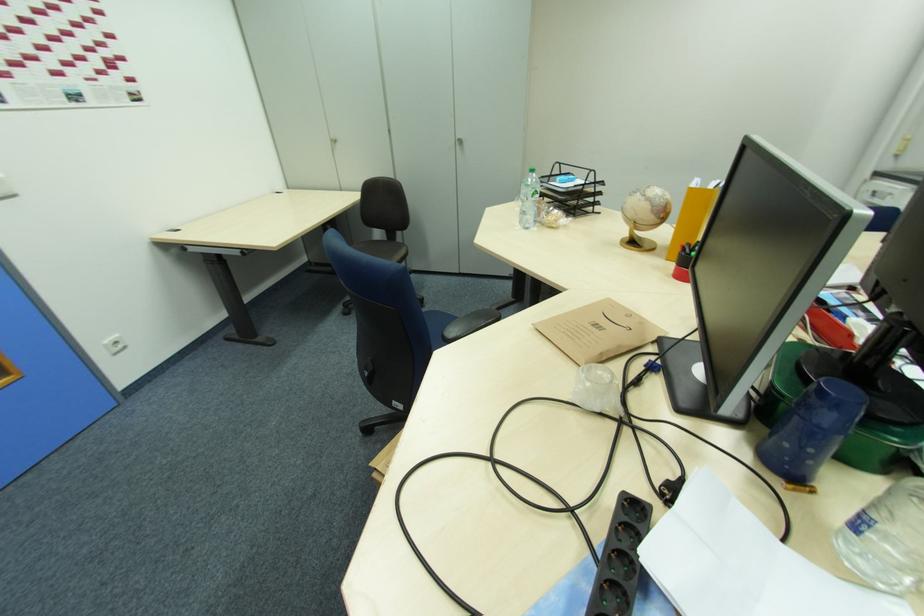
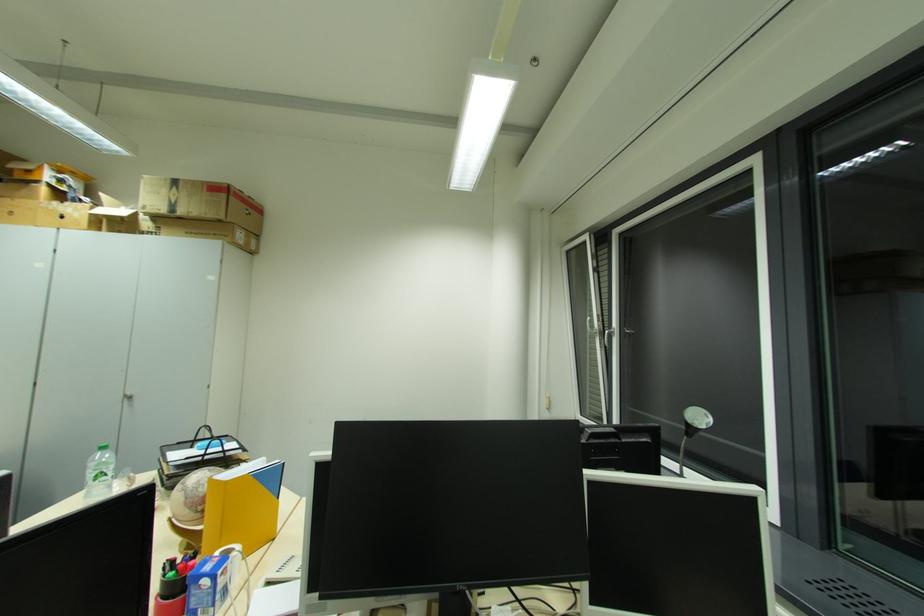
Where in the second image is the point corresponding to the point at 462,144 from the first image?

(128, 400)